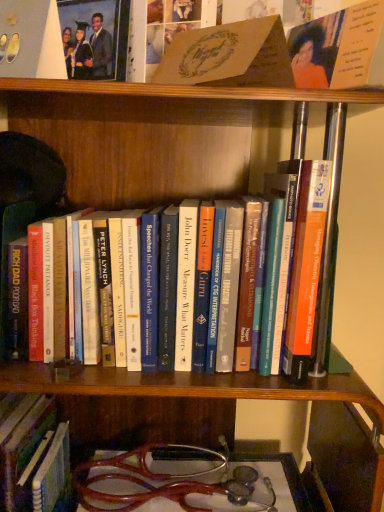
Question: Considering the positions of hardcover book at center, which is the 4th book from top to bottom, and matte brown card at upper center, the 3th book from the bottom, in the image, is hardcover book at center, which is the 4th book from top to bottom, wider or thinner than matte brown card at upper center, the 3th book from the bottom,?

Choices:
 (A) thin
 (B) wide

Answer: (B)

Question: Does point (52, 459) appear closer or farther from the camera than point (205, 84)?

Choices:
 (A) farther
 (B) closer

Answer: (A)

Question: Which of these objects is positioned closest to the matte black graduation gown at upper left?

Choices:
 (A) hardcover book at center, placed as the 3th book when sorted from top to bottom
 (B) hardcover book at center, which is the 1th book from bottom to top
 (C) orange matte card at upper right, acting as the first book starting from the top
 (D) matte brown card at upper center, the 3th book from the bottom

Answer: (D)

Question: Which of these objects is positioned farthest from the matte brown card at upper center, which ranks as the second book in top-to-bottom order?

Choices:
 (A) hardcover book at center, which is the 4th book from top to bottom
 (B) hardcover book at center, which appears as the 2th book when ordered from the bottom
 (C) matte black graduation gown at upper left
 (D) orange matte card at upper right, the 4th book ordered from the bottom

Answer: (A)